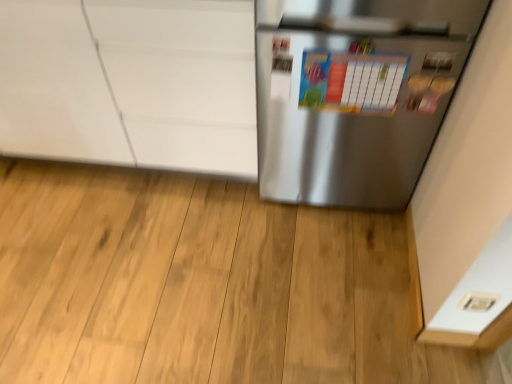
Describe the element at coordinates (355, 94) in the screenshot. I see `satin silver refrigerator at right` at that location.

What do you see at coordinates (352, 80) in the screenshot?
I see `colorful paperboard at center` at bounding box center [352, 80].

Locate an element on the screen. Image resolution: width=512 pixels, height=384 pixels. satin silver refrigerator at right is located at coordinates (355, 94).

From a real-world perspective, between satin silver refrigerator at right and white glossy cabinet at upper left, who is vertically higher?

In real-world perspective, satin silver refrigerator at right is above.

Is white glossy cabinet at upper left completely or partially inside satin silver refrigerator at right?

No.

Is satin silver refrigerator at right closer to camera compared to white glossy cabinet at upper left?

Yes, satin silver refrigerator at right is in front of white glossy cabinet at upper left.

From the image's perspective, which is below, satin silver refrigerator at right or white glossy cabinet at upper left?

satin silver refrigerator at right is shown below in the image.

Which object is positioned more to the right, colorful paperboard at center or white glossy cabinet at upper left?

Positioned to the right is colorful paperboard at center.

Is colorful paperboard at center looking in the opposite direction of white glossy cabinet at upper left?

colorful paperboard at center is not turned away from white glossy cabinet at upper left.

Is colorful paperboard at center inside the boundaries of white glossy cabinet at upper left, or outside?

colorful paperboard at center is not inside white glossy cabinet at upper left, it's outside.

Does colorful paperboard at center have a lesser height compared to white glossy cabinet at upper left?

Indeed, colorful paperboard at center has a lesser height compared to white glossy cabinet at upper left.

Considering the relative sizes of colorful paperboard at center and satin silver refrigerator at right in the image provided, is colorful paperboard at center thinner than satin silver refrigerator at right?

Correct, the width of colorful paperboard at center is less than that of satin silver refrigerator at right.

Could you tell me if colorful paperboard at center is facing satin silver refrigerator at right?

Yes, colorful paperboard at center is aimed at satin silver refrigerator at right.

Is colorful paperboard at center taller than satin silver refrigerator at right?

No.

Is white glossy cabinet at upper left bigger than colorful paperboard at center?

Yes, white glossy cabinet at upper left is bigger than colorful paperboard at center.

Considering the points (156, 119) and (362, 77), which point is in front, point (156, 119) or point (362, 77)?

The point (362, 77) is more forward.

Does white glossy cabinet at upper left appear on the left side of colorful paperboard at center?

Indeed, white glossy cabinet at upper left is positioned on the left side of colorful paperboard at center.

Does white glossy cabinet at upper left appear on the right side of satin silver refrigerator at right?

Incorrect, white glossy cabinet at upper left is not on the right side of satin silver refrigerator at right.

Which of these two, white glossy cabinet at upper left or satin silver refrigerator at right, is thinner?

With smaller width is satin silver refrigerator at right.

Would you say white glossy cabinet at upper left is inside or outside satin silver refrigerator at right?

white glossy cabinet at upper left lies outside satin silver refrigerator at right.

Which is behind, point (1, 132) or point (361, 89)?

The point (1, 132) is farther from the camera.

Considering the sizes of objects white plastic electric outlet at lower right and colorful paperboard at center in the image provided, who is smaller, white plastic electric outlet at lower right or colorful paperboard at center?

white plastic electric outlet at lower right is smaller.

Is white plastic electric outlet at lower right touching colorful paperboard at center?

No, white plastic electric outlet at lower right is not beside colorful paperboard at center.

From a real-world perspective, who is located lower, white plastic electric outlet at lower right or colorful paperboard at center?

In real-world perspective, white plastic electric outlet at lower right is lower.

Considering the positions of objects white plastic electric outlet at lower right and colorful paperboard at center in the image provided, who is in front, white plastic electric outlet at lower right or colorful paperboard at center?

white plastic electric outlet at lower right.

Measure the distance between white plastic electric outlet at lower right and white glossy cabinet at upper left.

white plastic electric outlet at lower right and white glossy cabinet at upper left are 4.05 feet apart.

Is white plastic electric outlet at lower right bigger than white glossy cabinet at upper left?

No.

Who is taller, white plastic electric outlet at lower right or white glossy cabinet at upper left?

white glossy cabinet at upper left is taller.

From the image's perspective, which one is positioned lower, white plastic electric outlet at lower right or white glossy cabinet at upper left?

white plastic electric outlet at lower right appears lower in the image.

At what (x,y) coordinates should I click in order to perform the action: click on cabinetry located above the satin silver refrigerator at right (from the image's perspective). Please return your answer as a coordinate pair (x, y). Looking at the image, I should click on (130, 83).

Find the location of `cabinetry on the left of colorful paperboard at center`. cabinetry on the left of colorful paperboard at center is located at coordinates (130, 83).

Estimate the real-world distances between objects in this image. Which object is closer to white glossy cabinet at upper left, white plastic electric outlet at lower right or satin silver refrigerator at right?

Among the two, satin silver refrigerator at right is located nearer to white glossy cabinet at upper left.

From the image, which object appears to be farther from colorful paperboard at center, white glossy cabinet at upper left or satin silver refrigerator at right?

white glossy cabinet at upper left.

From the picture: Looking at the image, which one is located closer to satin silver refrigerator at right, colorful paperboard at center or white plastic electric outlet at lower right?

colorful paperboard at center is closer to satin silver refrigerator at right.

Based on their spatial positions, is white glossy cabinet at upper left or colorful paperboard at center closer to satin silver refrigerator at right?

The object closer to satin silver refrigerator at right is colorful paperboard at center.

From the picture: Which object lies further to the anchor point satin silver refrigerator at right, white plastic electric outlet at lower right or white glossy cabinet at upper left?

white plastic electric outlet at lower right is further to satin silver refrigerator at right.

Considering their positions, is colorful paperboard at center positioned further to white glossy cabinet at upper left than white plastic electric outlet at lower right?

white plastic electric outlet at lower right is positioned further to the anchor white glossy cabinet at upper left.

Considering their positions, is colorful paperboard at center positioned further to satin silver refrigerator at right than white glossy cabinet at upper left?

The object further to satin silver refrigerator at right is white glossy cabinet at upper left.

Which object lies nearer to the anchor point satin silver refrigerator at right, white glossy cabinet at upper left or white plastic electric outlet at lower right?

white glossy cabinet at upper left lies closer to satin silver refrigerator at right than the other object.

Identify the location of bulletin board situated between white glossy cabinet at upper left and white plastic electric outlet at lower right from left to right. (352, 80).

At what (x,y) coordinates should I click in order to perform the action: click on bulletin board between satin silver refrigerator at right and white plastic electric outlet at lower right in the up-down direction. Please return your answer as a coordinate pair (x, y). This screenshot has height=384, width=512. Looking at the image, I should click on (352, 80).

Identify the location of refrigerator between white glossy cabinet at upper left and white plastic electric outlet at lower right from left to right. (355, 94).

Where is `bulletin board between white glossy cabinet at upper left and satin silver refrigerator at right`? The height and width of the screenshot is (384, 512). bulletin board between white glossy cabinet at upper left and satin silver refrigerator at right is located at coordinates (352, 80).